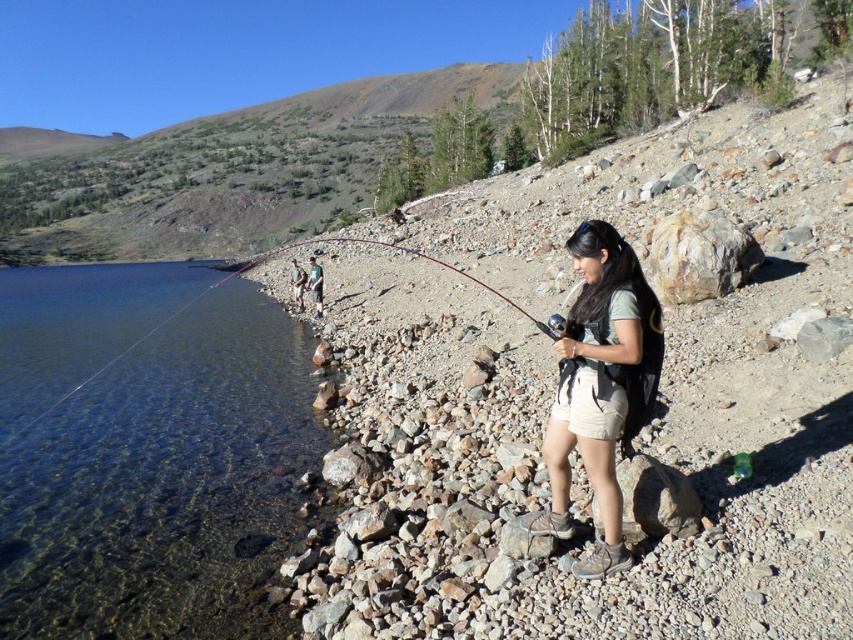
Which is below, matte gray shirt at center or green fabric backpack at center?

matte gray shirt at center

Consider the image. Is matte gray shirt at center taller than green fabric backpack at center?

No.

What do you see at coordinates (601, 387) in the screenshot? This screenshot has height=640, width=853. I see `matte gray shirt at center` at bounding box center [601, 387].

Where is `matte gray shirt at center`? matte gray shirt at center is located at coordinates (601, 387).

Can you confirm if clear water at lake left is positioned above green fabric shirt at center?

Actually, clear water at lake left is below green fabric shirt at center.

Based on the photo, can you confirm if clear water at lake left is positioned below green fabric shirt at center?

Yes, clear water at lake left is below green fabric shirt at center.

Looking at this image, who is more forward, [184,369] or [299,266]?

Point [184,369] is more forward.

Locate an element on the screen. clear water at lake left is located at coordinates (165, 484).

Between green fabric backpack at center and green fabric shirt at center, which one has more height?

green fabric shirt at center is taller.

Can you confirm if green fabric backpack at center is bigger than green fabric shirt at center?

Actually, green fabric backpack at center might be smaller than green fabric shirt at center.

Where is `green fabric backpack at center`? The image size is (853, 640). green fabric backpack at center is located at coordinates (315, 285).

You are a GUI agent. You are given a task and a screenshot of the screen. Output one action in this format:
    pyautogui.click(x=<x>, y=<y>)
    Task: Click on the green fabric backpack at center
    Image resolution: width=853 pixels, height=640 pixels.
    Given the screenshot: What is the action you would take?
    pyautogui.click(x=315, y=285)